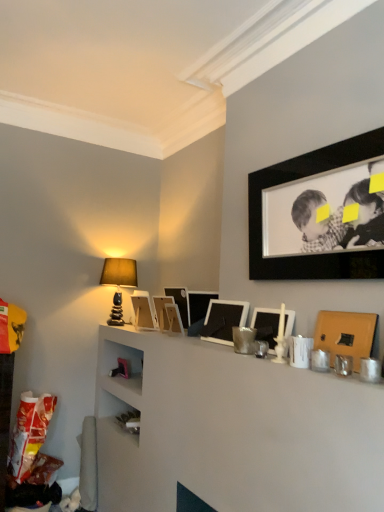
Question: Is black matte picture frame at upper right, which ranks as the first picture frame in front-to-back order, in contact with matte white picture frame at upper center, acting as the 8th picture frame starting from the front?

Choices:
 (A) no
 (B) yes

Answer: (A)

Question: Can you confirm if black matte picture frame at upper right, arranged as the eighth picture frame when viewed from the back, is taller than matte white picture frame at upper center, acting as the 8th picture frame starting from the front?

Choices:
 (A) no
 (B) yes

Answer: (B)

Question: Would you say black matte picture frame at upper right, which ranks as the first picture frame in front-to-back order, contains matte white picture frame at upper center, the first picture frame from the back?

Choices:
 (A) no
 (B) yes

Answer: (A)

Question: Is black matte picture frame at upper right, arranged as the eighth picture frame when viewed from the back, outside of matte white picture frame at upper center, the first picture frame from the back?

Choices:
 (A) yes
 (B) no

Answer: (A)

Question: Is black matte picture frame at upper right, arranged as the eighth picture frame when viewed from the back, positioned with its back to matte white picture frame at upper center, acting as the 8th picture frame starting from the front?

Choices:
 (A) yes
 (B) no

Answer: (B)

Question: Considering the relative positions of black matte picture frame at upper right, arranged as the eighth picture frame when viewed from the back, and matte white picture frame at upper center, the first picture frame from the back, in the image provided, is black matte picture frame at upper right, arranged as the eighth picture frame when viewed from the back, to the right of matte white picture frame at upper center, the first picture frame from the back, from the viewer's perspective?

Choices:
 (A) no
 (B) yes

Answer: (B)

Question: Does matte black picture frame at center, which appears as the fourth picture frame when viewed from the back, come behind matte stone table lamp at upper left?

Choices:
 (A) yes
 (B) no

Answer: (B)

Question: Considering the relative sizes of matte black picture frame at center, which is the 5th picture frame in front-to-back order, and matte stone table lamp at upper left in the image provided, is matte black picture frame at center, which is the 5th picture frame in front-to-back order, bigger than matte stone table lamp at upper left?

Choices:
 (A) no
 (B) yes

Answer: (A)

Question: Would you say matte stone table lamp at upper left is part of matte black picture frame at center, which is the 5th picture frame in front-to-back order,'s contents?

Choices:
 (A) yes
 (B) no

Answer: (B)

Question: Considering the relative sizes of matte black picture frame at center, which appears as the fourth picture frame when viewed from the back, and matte stone table lamp at upper left in the image provided, is matte black picture frame at center, which appears as the fourth picture frame when viewed from the back, thinner than matte stone table lamp at upper left?

Choices:
 (A) no
 (B) yes

Answer: (B)

Question: Does matte black picture frame at center, which is the 5th picture frame in front-to-back order, turn towards matte stone table lamp at upper left?

Choices:
 (A) no
 (B) yes

Answer: (A)

Question: Is matte black picture frame at center, which is the 5th picture frame in front-to-back order, smaller than matte stone table lamp at upper left?

Choices:
 (A) no
 (B) yes

Answer: (B)

Question: Are matte stone table lamp at upper left and wooden picture frame at center, positioned as the 3th picture frame in back-to-front order, making contact?

Choices:
 (A) yes
 (B) no

Answer: (B)